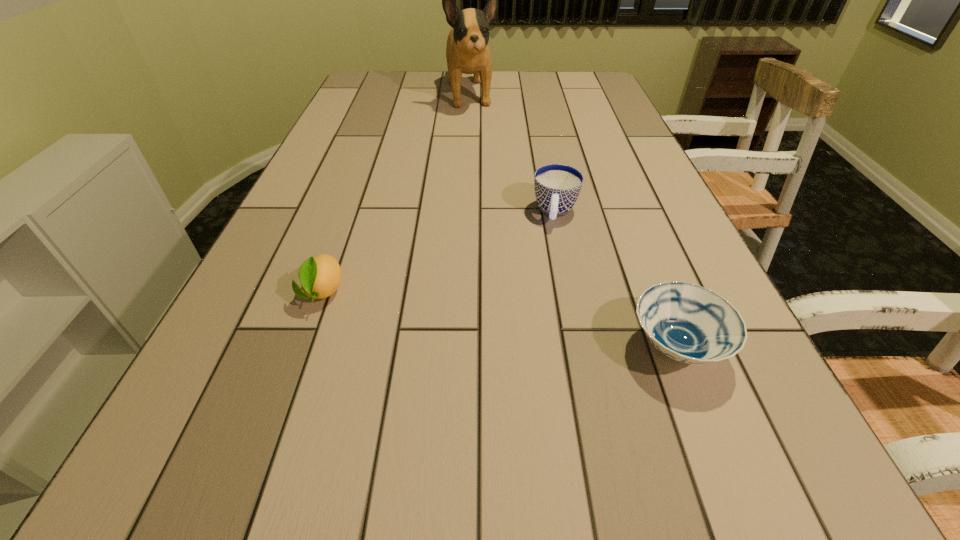
Identify the location of blank space located at the face of the farthest object. (487, 164).

Where is `vacant space located on the side of the third object from left to right with the handle`? The width and height of the screenshot is (960, 540). vacant space located on the side of the third object from left to right with the handle is located at coordinates (x=552, y=245).

The height and width of the screenshot is (540, 960). I want to click on vacant position located 0.400m on the side of the third object from left to right with the handle, so click(534, 387).

The width and height of the screenshot is (960, 540). I want to click on free region located 0.390m on the side of the third object from left to right with the handle, so click(535, 381).

Image resolution: width=960 pixels, height=540 pixels. I want to click on object present at the far edge, so click(467, 51).

The image size is (960, 540). Find the location of `object positioned at the left edge`. object positioned at the left edge is located at coordinates (320, 276).

Locate an element on the screen. Image resolution: width=960 pixels, height=540 pixels. object positioned at the right edge is located at coordinates (686, 322).

Where is `vacant space at the near edge of the desktop`? The height and width of the screenshot is (540, 960). vacant space at the near edge of the desktop is located at coordinates (401, 413).

Find the location of a particular element. The height and width of the screenshot is (540, 960). vacant space at the left edge of the desktop is located at coordinates (237, 363).

The image size is (960, 540). What are the coordinates of `vacant space at the right edge of the desktop` in the screenshot? It's located at pyautogui.click(x=683, y=262).